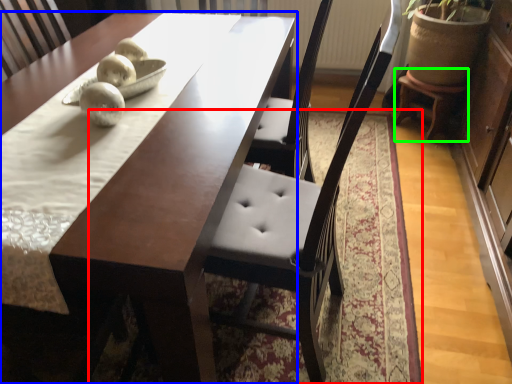
Question: Which is nearer to the mat (highlighted by a red box)? table (highlighted by a blue box) or stool (highlighted by a green box).

Choices:
 (A) table
 (B) stool

Answer: (A)